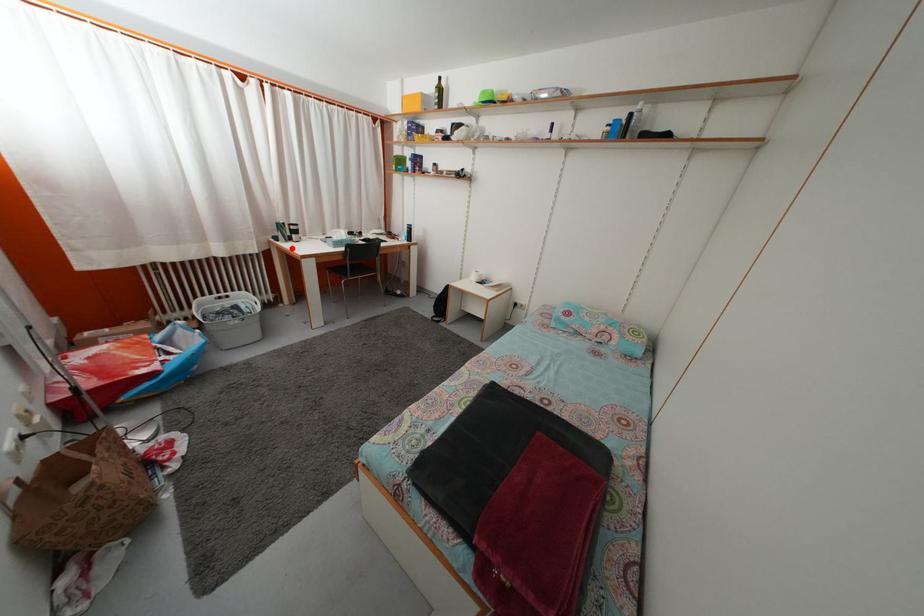
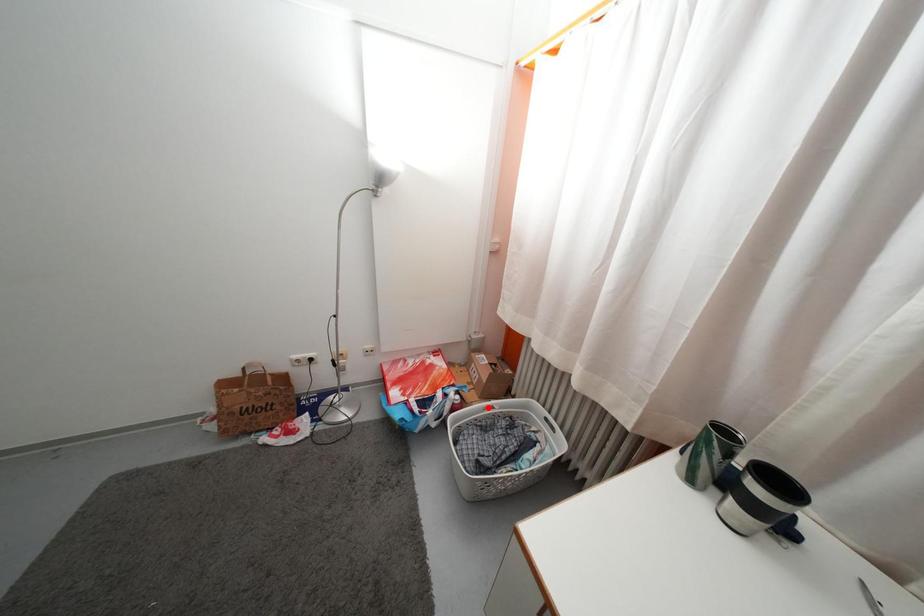
I am providing you with two images of the same scene from different viewpoints. A red point is marked on the first image and another point is marked on the second image. Are the points marked in image1 and image2 representing the same 3D position?

No